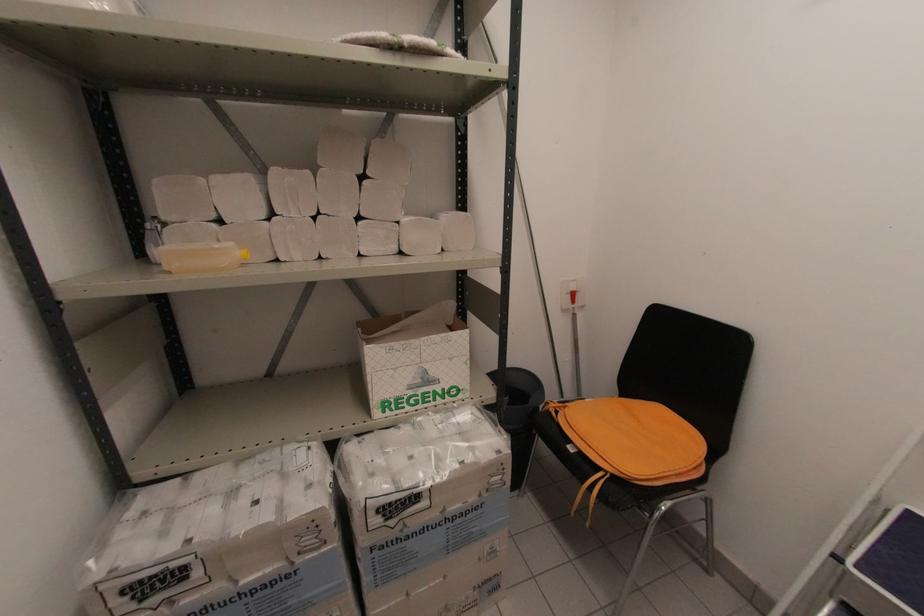
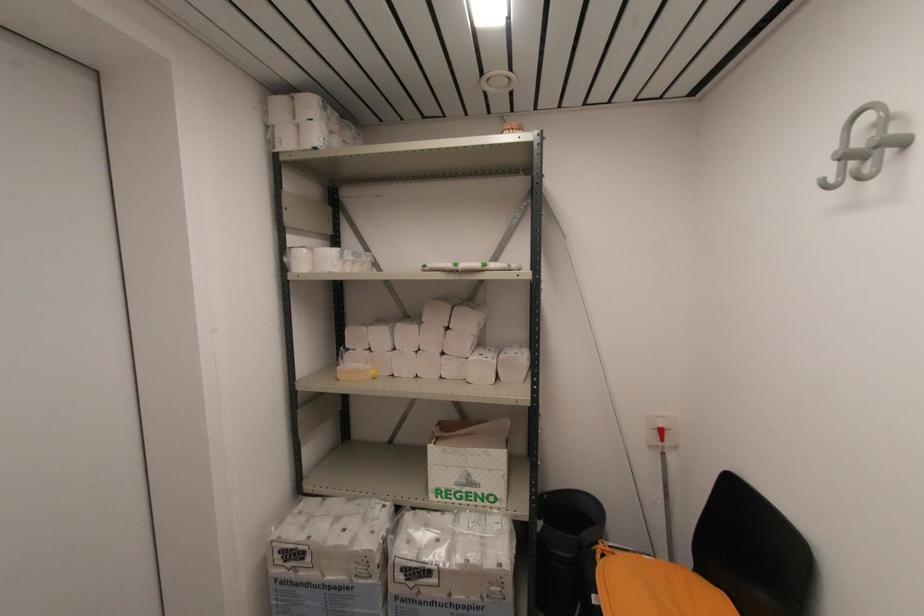
The point at (419,381) is marked in the first image. Where is the corresponding point in the second image?

(465, 480)